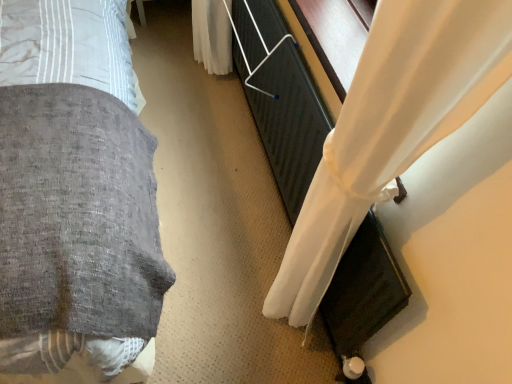
Image resolution: width=512 pixels, height=384 pixels. Describe the element at coordinates (67, 45) in the screenshot. I see `textured gray blanket at left` at that location.

What are the coordinates of `textured gray blanket at left` in the screenshot? It's located at (67, 45).

In order to face textured gray blanket at left, should I rotate leftwards or rightwards?

A 26.179 degree turn to the left will do.

What is the approximate width of textured gray blanket at left?

6.08 feet.

I want to click on white sheer curtain at right, so click(x=390, y=128).

This screenshot has width=512, height=384. What do you see at coordinates (390, 128) in the screenshot?
I see `white sheer curtain at right` at bounding box center [390, 128].

What is the approximate width of white sheer curtain at right?

The width of white sheer curtain at right is 1.46 inches.

Identify the location of textured gray blanket at left. The width and height of the screenshot is (512, 384). (67, 45).

Which object is positioned more to the right, white sheer curtain at right or textured gray blanket at left?

white sheer curtain at right.

Which is in front, white sheer curtain at right or textured gray blanket at left?

Positioned in front is textured gray blanket at left.

Does point (289, 301) appear closer or farther from the camera than point (19, 36)?

Clearly, point (289, 301) is more distant from the camera than point (19, 36).

From the image's perspective, who appears lower, white sheer curtain at right or textured gray blanket at left?

From the image's view, white sheer curtain at right is below.

From a real-world perspective, which is physically below, white sheer curtain at right or textured gray blanket at left?

white sheer curtain at right is physically lower.

Between white sheer curtain at right and textured gray blanket at left, which one has larger width?

Wider between the two is textured gray blanket at left.

Between white sheer curtain at right and textured gray blanket at left, which one has less height?

white sheer curtain at right.

Can you confirm if white sheer curtain at right is smaller than textured gray blanket at left?

Indeed, white sheer curtain at right has a smaller size compared to textured gray blanket at left.

Does white sheer curtain at right contain textured gray blanket at left?

No, textured gray blanket at left is not surrounded by white sheer curtain at right.

Would you consider white sheer curtain at right to be distant from textured gray blanket at left?

No.

Does white sheer curtain at right turn towards textured gray blanket at left?

Yes, white sheer curtain at right is turned towards textured gray blanket at left.

Can you tell me how much white sheer curtain at right and textured gray blanket at left differ in facing direction?

The angular difference between white sheer curtain at right and textured gray blanket at left is 89.3 degrees.

Where is `curtain lying below the textured gray blanket at left (from the image's perspective)`? curtain lying below the textured gray blanket at left (from the image's perspective) is located at coordinates (390, 128).

Is textured gray blanket at left at the left side of white sheer curtain at right?

Indeed, textured gray blanket at left is positioned on the left side of white sheer curtain at right.

Is textured gray blanket at left behind white sheer curtain at right?

No, textured gray blanket at left is closer to the camera.

Which is in front, point (129, 108) or point (322, 263)?

The point (322, 263) is closer.

From the image's perspective, is textured gray blanket at left under white sheer curtain at right?

Incorrect, from the image's perspective, textured gray blanket at left is higher than white sheer curtain at right.

Looking at this image, from a real-world perspective, is textured gray blanket at left physically located above or below white sheer curtain at right?

textured gray blanket at left is situated higher than white sheer curtain at right in the real world.

Is textured gray blanket at left thinner than white sheer curtain at right?

In fact, textured gray blanket at left might be wider than white sheer curtain at right.

Considering the relative sizes of textured gray blanket at left and white sheer curtain at right in the image provided, is textured gray blanket at left taller than white sheer curtain at right?

Yes, textured gray blanket at left is taller than white sheer curtain at right.

Who is smaller, textured gray blanket at left or white sheer curtain at right?

white sheer curtain at right.

Choose the correct answer: Is textured gray blanket at left inside white sheer curtain at right or outside it?

textured gray blanket at left exists outside the volume of white sheer curtain at right.

Is textured gray blanket at left not near white sheer curtain at right?

No, textured gray blanket at left is not far away from white sheer curtain at right.

Is textured gray blanket at left positioned with its back to white sheer curtain at right?

No, textured gray blanket at left's orientation is not away from white sheer curtain at right.

Locate an element on the screen. This screenshot has width=512, height=384. bed in front of the white sheer curtain at right is located at coordinates (67, 45).

Identify the location of curtain behind the textured gray blanket at left. The height and width of the screenshot is (384, 512). (390, 128).

In the image, there is a textured gray blanket at left. Where is `curtain below it (from a real-world perspective)`? Image resolution: width=512 pixels, height=384 pixels. curtain below it (from a real-world perspective) is located at coordinates (390, 128).